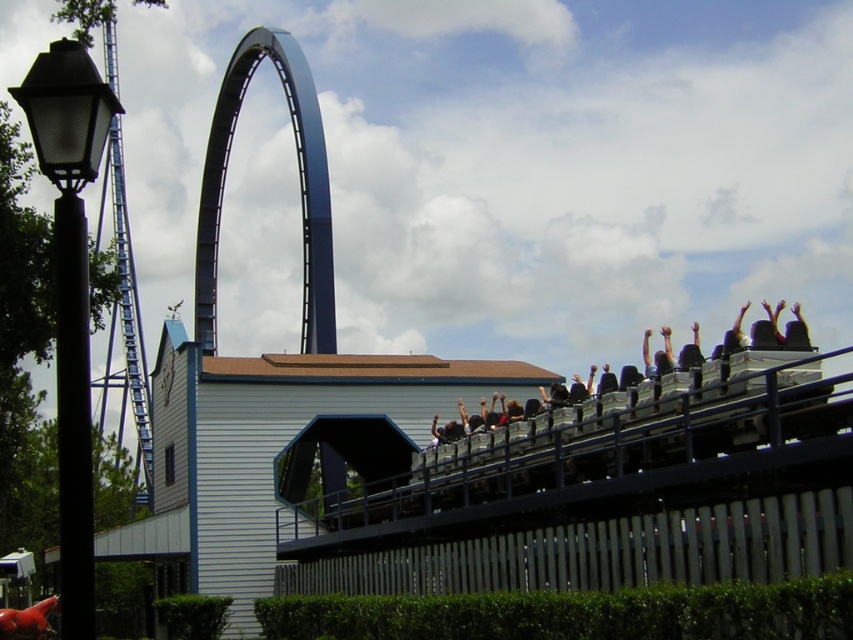
Which is behind, point (583, 545) or point (641, 604)?

Point (583, 545)

Can you confirm if metallic silver fence at lower center is taller than green leafy hedge at lower center?

Yes.

Which is behind, point (368, 572) or point (746, 609)?

Point (368, 572)

You are a GUI agent. You are given a task and a screenshot of the screen. Output one action in this format:
    pyautogui.click(x=<x>, y=<y>)
    Task: Click on the metallic silver fence at lower center
    The image size is (853, 640).
    Given the screenshot: What is the action you would take?
    click(x=606, y=552)

Which is below, green leafy hedge at lower center or blue metallic roller coaster at upper center?

green leafy hedge at lower center

Which of these two, green leafy hedge at lower center or blue metallic roller coaster at upper center, stands shorter?

green leafy hedge at lower center

Between point (317, 627) and point (207, 172), which one is positioned behind?

The point (207, 172) is more distant.

Locate an element on the screen. green leafy hedge at lower center is located at coordinates (576, 612).

Is metallic silver fence at lower center above blue metallic roller coaster at upper center?

No, metallic silver fence at lower center is not above blue metallic roller coaster at upper center.

Is point (355, 554) farther from viewer compared to point (315, 102)?

No, it is in front of (315, 102).

What do you see at coordinates (606, 552) in the screenshot?
I see `metallic silver fence at lower center` at bounding box center [606, 552].

Locate an element on the screen. The height and width of the screenshot is (640, 853). metallic silver fence at lower center is located at coordinates (606, 552).